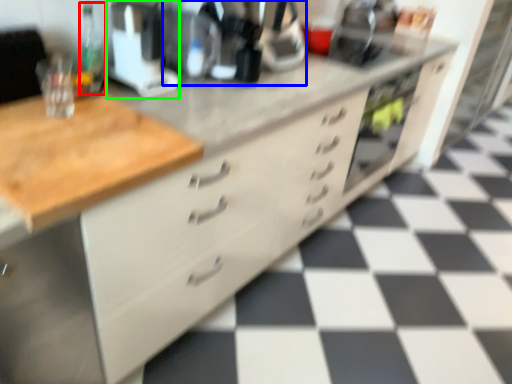
Question: Which object is positioned closest to bottle (highlighted by a red box)? Select from coffee machine (highlighted by a blue box) and appliance (highlighted by a green box).

Choices:
 (A) coffee machine
 (B) appliance

Answer: (B)